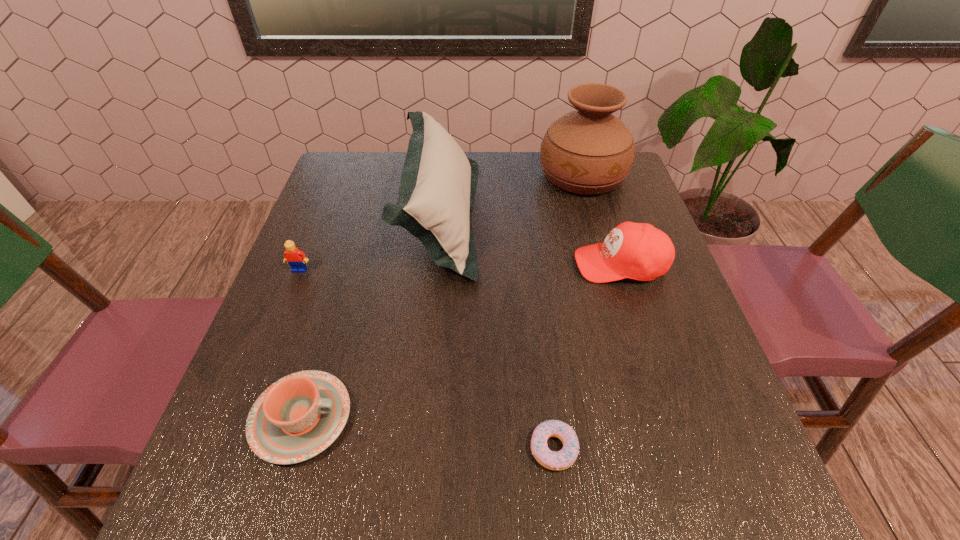
Locate an element on the screen. The width and height of the screenshot is (960, 540). Lego that is at the left edge is located at coordinates (296, 258).

I want to click on chinaware that is at the left edge, so (x=296, y=418).

Identify the location of urn present at the right edge. (588, 151).

The image size is (960, 540). What are the coordinates of `baseball cap at the right edge` in the screenshot? It's located at (639, 251).

I want to click on object present at the near left corner, so [x=296, y=418].

Identify the location of object that is at the far right corner. (588, 151).

The image size is (960, 540). In the image, there is a desktop. Find the location of `vacant area at the near edge`. vacant area at the near edge is located at coordinates (382, 474).

I want to click on free space at the left edge of the desktop, so click(220, 461).

Where is `free space at the right edge of the desktop`? Image resolution: width=960 pixels, height=540 pixels. free space at the right edge of the desktop is located at coordinates (654, 292).

The image size is (960, 540). Identify the location of vacant region at the near left corner of the desktop. click(x=257, y=502).